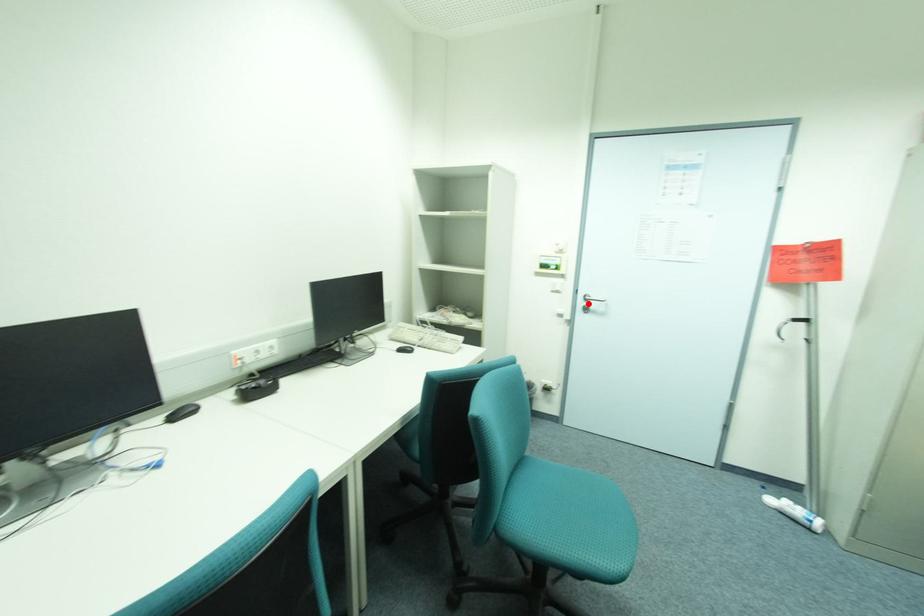
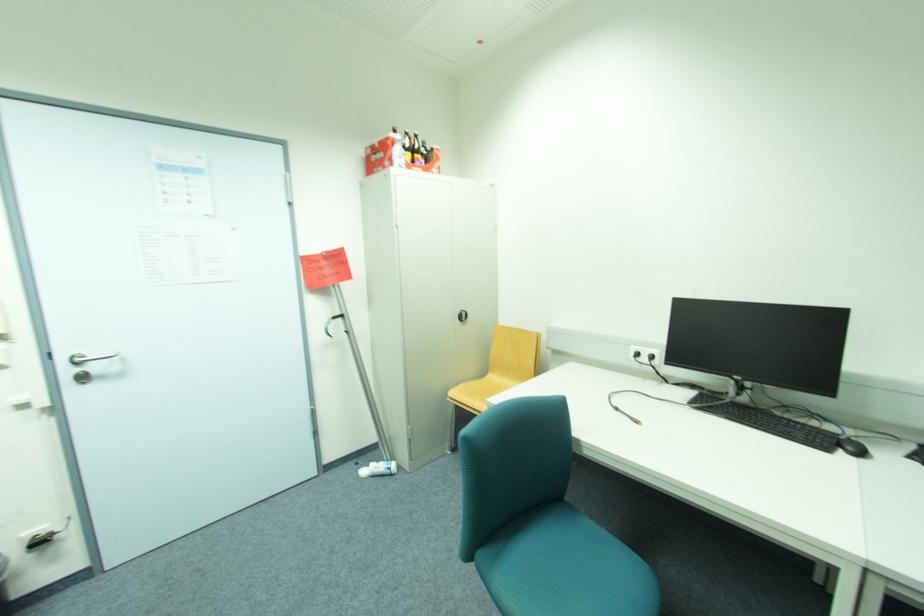
Where in the second image is the point corresponding to the highlighted location from the first image?

(74, 371)